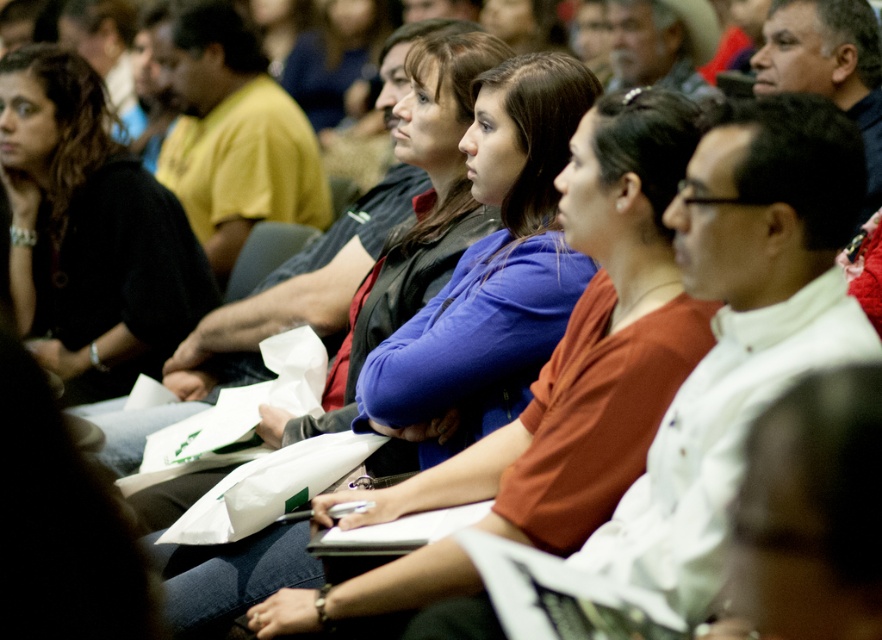
Who is positioned more to the right, blue matte shirt at center or yellow matte shirt at center?

From the viewer's perspective, blue matte shirt at center appears more on the right side.

Is blue matte shirt at center behind yellow matte shirt at center?

No, it is not.

Which is in front, point (582, 116) or point (260, 141)?

Point (582, 116) is more forward.

Locate an element on the screen. blue matte shirt at center is located at coordinates (626, 208).

Who is lower down, black sweater at left or yellow matte shirt at center?

black sweater at left

What do you see at coordinates (90, 232) in the screenshot? The width and height of the screenshot is (882, 640). I see `black sweater at left` at bounding box center [90, 232].

Identify the location of black sweater at left. (90, 232).

This screenshot has width=882, height=640. I want to click on black sweater at left, so click(90, 232).

Which is in front, point (649, 205) or point (36, 260)?

Positioned in front is point (649, 205).

Image resolution: width=882 pixels, height=640 pixels. Describe the element at coordinates (626, 208) in the screenshot. I see `blue matte shirt at center` at that location.

What do you see at coordinates (626, 208) in the screenshot? I see `blue matte shirt at center` at bounding box center [626, 208].

What are the coordinates of `blue matte shirt at center` in the screenshot? It's located at (626, 208).